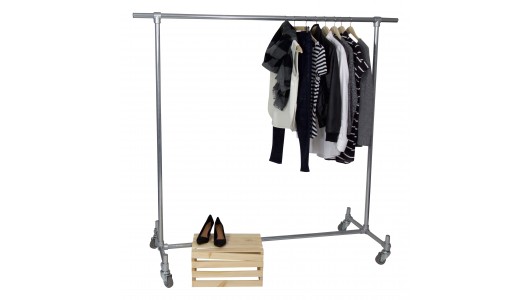
Locate an element on the screen. Image resolution: width=530 pixels, height=300 pixels. clothes hanger is located at coordinates (351, 29), (342, 27), (332, 27), (325, 27), (318, 27), (299, 27), (307, 19), (287, 20).